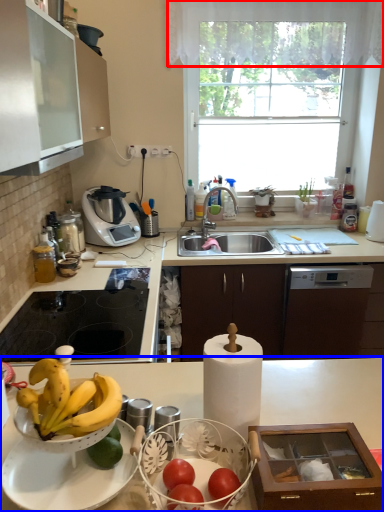
Question: Which object is closer to the camera taking this photo, curtain (highlighted by a red box) or countertop (highlighted by a blue box)?

Choices:
 (A) curtain
 (B) countertop

Answer: (B)